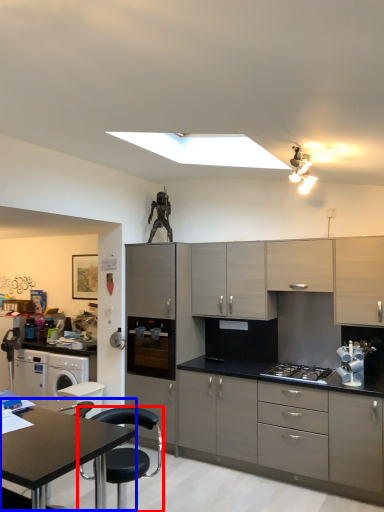
Question: Which point is closer to the camera, chair (highlighted by a red box) or table (highlighted by a blue box)?

Choices:
 (A) chair
 (B) table

Answer: (B)